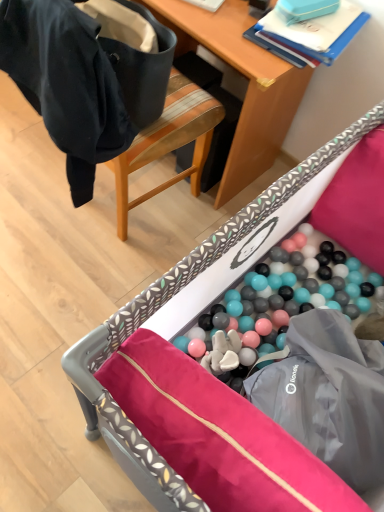
The height and width of the screenshot is (512, 384). Identify the location of vacant space underneath black fabric chair at upper left (from a real-world perspective). 133,194.